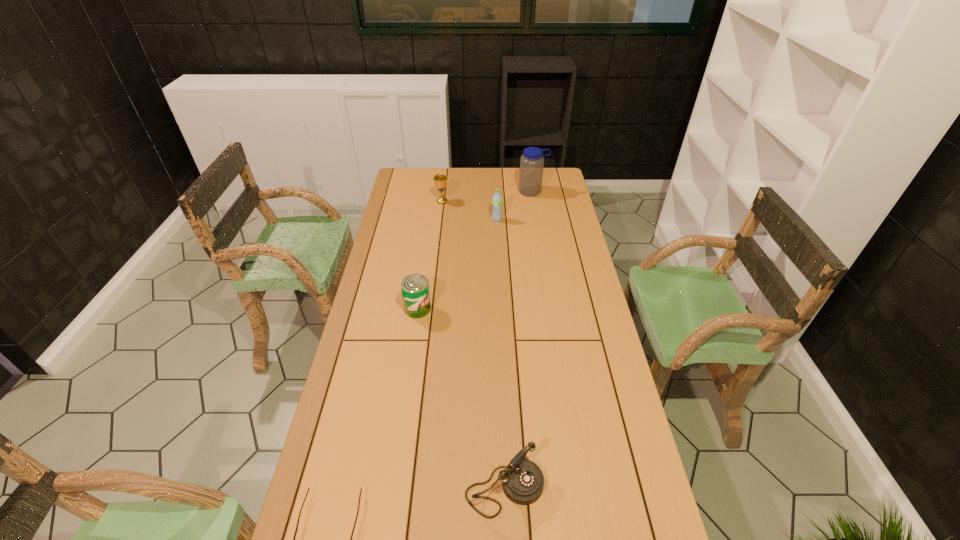
At what (x,y) coordinates should I click in order to perform the action: click on vacant area that lies between the nearer water bottle and the farthest object. Please return your answer as a coordinate pair (x, y). The image size is (960, 540). Looking at the image, I should click on (515, 205).

Locate an element on the screen. vacant area between the can and the telephone is located at coordinates (461, 399).

Identify the location of free space between the fourth farthest object and the chalice. Image resolution: width=960 pixels, height=540 pixels. (430, 255).

This screenshot has width=960, height=540. What are the coordinates of `empty space between the fifth nearest object and the telephone` in the screenshot? It's located at (x=473, y=345).

The width and height of the screenshot is (960, 540). Find the location of `vacant space that's between the right water bottle and the telephone`. vacant space that's between the right water bottle and the telephone is located at coordinates point(518,340).

Where is `empty space that is in between the can and the second farthest object`? The image size is (960, 540). empty space that is in between the can and the second farthest object is located at coordinates (430, 255).

This screenshot has height=540, width=960. What are the coordinates of `object that can be found as the fourth closest to the third farthest object` in the screenshot? It's located at (522, 480).

Locate which object is the fourth closest to the telephone. Please provide its 2D coordinates. Your answer should be formatted as a tuple, i.e. [(x, y)], where the tuple contains the x and y coordinates of a point satisfying the conditions above.

[(440, 180)]

You are a GUI agent. You are given a task and a screenshot of the screen. Output one action in this format:
    pyautogui.click(x=<x>, y=<y>)
    Task: Click on the vacant space that satisfies the following two spatial constraints: 1. on the front side of the telephone; 2. on the right side of the third nearest object
    The image size is (960, 540).
    Given the screenshot: What is the action you would take?
    pyautogui.click(x=392, y=488)